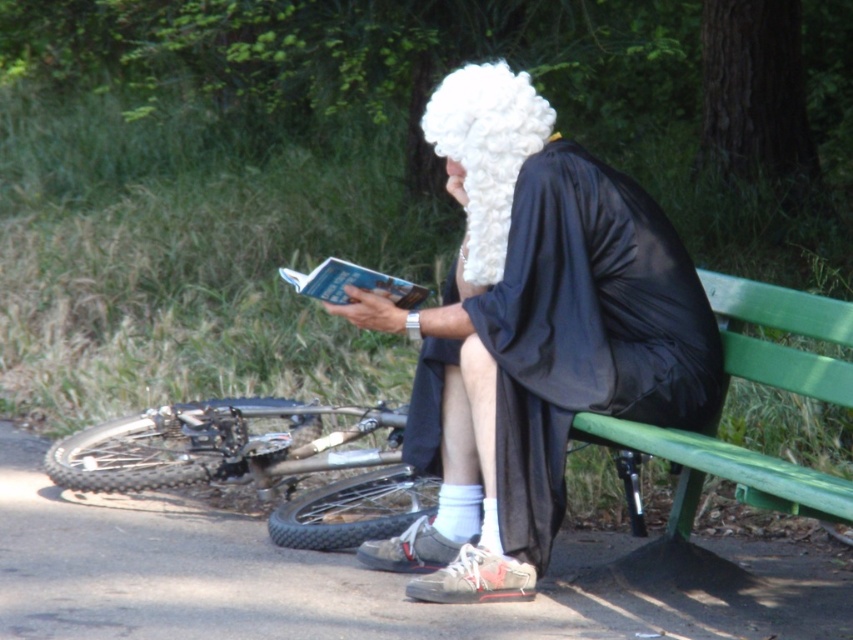
Does shiny metallic bicycle at lower left appear on the right side of white fluffy wig at center?

Incorrect, shiny metallic bicycle at lower left is not on the right side of white fluffy wig at center.

Identify the location of shiny metallic bicycle at lower left. (257, 465).

Locate an element on the screen. This screenshot has height=640, width=853. shiny metallic bicycle at lower left is located at coordinates (257, 465).

At what (x,y) coordinates should I click in order to perform the action: click on shiny metallic bicycle at lower left. Please return your answer as a coordinate pair (x, y). Looking at the image, I should click on (257, 465).

Image resolution: width=853 pixels, height=640 pixels. Find the location of `black satin robe at center`. black satin robe at center is located at coordinates (585, 330).

Between point (544, 188) and point (177, 433), which one is positioned behind?

Positioned behind is point (177, 433).

This screenshot has width=853, height=640. What are the coordinates of `black satin robe at center` in the screenshot? It's located at (585, 330).

Which is more to the right, green painted wood bench at lower right or white fluffy wig at center?

green painted wood bench at lower right is more to the right.

Find the location of `green painted wood bench at lower right`. green painted wood bench at lower right is located at coordinates (724, 472).

Is point (695, 476) farther from viewer compared to point (503, 76)?

Yes, it is.

The image size is (853, 640). I want to click on green painted wood bench at lower right, so click(x=724, y=472).